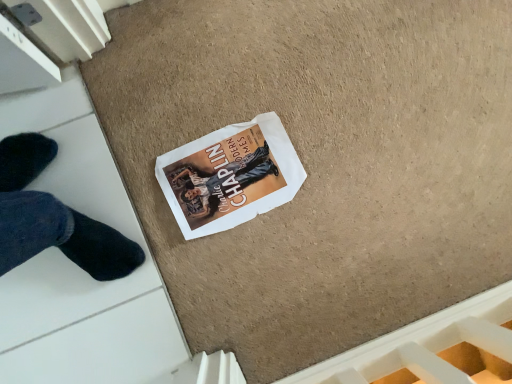
Image resolution: width=512 pixels, height=384 pixels. What do you see at coordinates (230, 176) in the screenshot?
I see `white paper magazine at center` at bounding box center [230, 176].

Where is `white paper magazine at center`? This screenshot has width=512, height=384. white paper magazine at center is located at coordinates (230, 176).

What are the coordinates of `white paper magazine at center` in the screenshot? It's located at (230, 176).